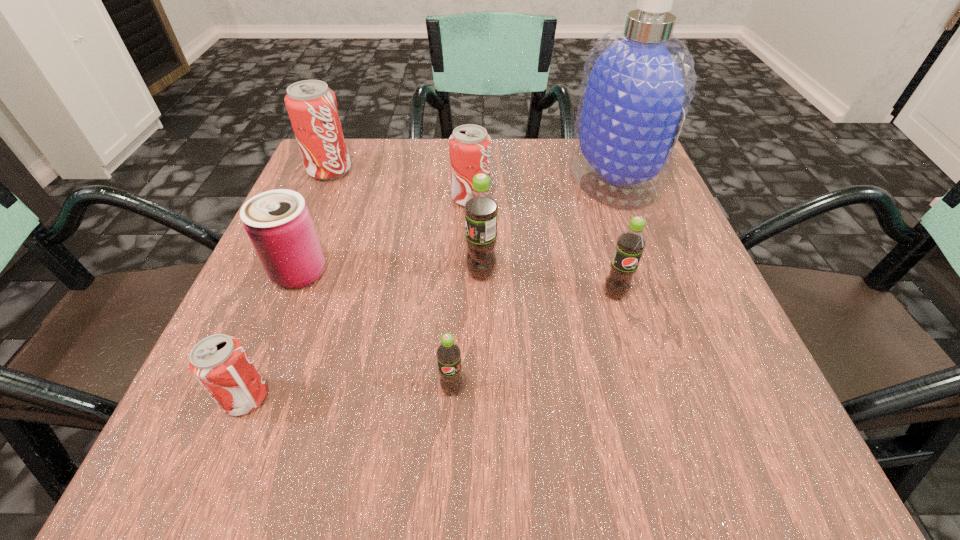
Find the location of a particular element. free space between the smallest pink soda can and the rightmost soda is located at coordinates (430, 346).

Where is `unoccupied area between the can and the smallest green soda`? The width and height of the screenshot is (960, 540). unoccupied area between the can and the smallest green soda is located at coordinates (375, 330).

The height and width of the screenshot is (540, 960). I want to click on unoccupied area between the rightmost pink soda can and the nearest green soda, so click(462, 293).

I want to click on free space between the tallest object and the rightmost soda, so click(613, 237).

This screenshot has height=540, width=960. I want to click on vacant region between the pink can and the second nearest pink soda can, so click(385, 235).

This screenshot has width=960, height=540. In order to click on blank region between the farthest soda and the biggest green soda in this screenshot , I will do `click(405, 222)`.

Identify which object is the seventh nearest to the smallest pink soda can. Please provide its 2D coordinates. Your answer should be formatted as a tuple, i.e. [(x, y)], where the tuple contains the x and y coordinates of a point satisfying the conditions above.

[(638, 82)]

I want to click on object that is the fourth closest to the can, so click(x=469, y=146).

Select which soda is the second closest to the tallest object. Please provide its 2D coordinates. Your answer should be formatted as a tuple, i.e. [(x, y)], where the tuple contains the x and y coordinates of a point satisfying the conditions above.

[(630, 244)]

Find the location of `the closest soda to the second nearest pink soda can`. the closest soda to the second nearest pink soda can is located at coordinates (481, 208).